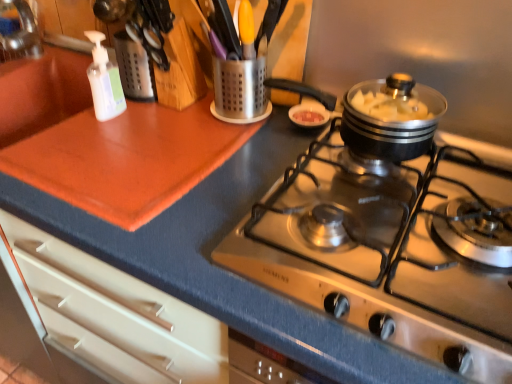
You are a GUI agent. You are given a task and a screenshot of the screen. Output one action in this format:
    pyautogui.click(x=<x>, y=<y>)
    Task: Click on the metallic utensil holder at upper center
    
    Given the screenshot: What is the action you would take?
    pyautogui.click(x=244, y=68)

I want to click on stainless steel cooktop at center, so click(386, 240).

Between white translucent bottle at upper left and metallic utensil holder at upper center, which one has more height?

white translucent bottle at upper left is taller.

The height and width of the screenshot is (384, 512). I want to click on appliance that appears below the white translucent bottle at upper left (from the image's perspective), so click(x=244, y=68).

Measure the distance from white translucent bottle at upper left to metallic utensil holder at upper center.

A distance of 10.73 inches exists between white translucent bottle at upper left and metallic utensil holder at upper center.

Could metallic utensil holder at upper center be considered to be inside white translucent bottle at upper left?

Definitely not — metallic utensil holder at upper center is not inside white translucent bottle at upper left.

Which point is more distant from viewer, (x=483, y=233) or (x=109, y=86)?

Point (x=109, y=86)

The width and height of the screenshot is (512, 384). I want to click on gas stove on the right of white translucent bottle at upper left, so click(x=386, y=240).

From the image's perspective, is stainless steel cooktop at center below white translucent bottle at upper left?

Yes, from the image's perspective, stainless steel cooktop at center is beneath white translucent bottle at upper left.

Is white translucent bottle at upper left at the back of metallic utensil holder at upper center?

No.

Which object is further away from the camera, metallic utensil holder at upper center or white translucent bottle at upper left?

metallic utensil holder at upper center is more distant.

Which of these two, metallic utensil holder at upper center or white translucent bottle at upper left, is thinner?

Thinner between the two is white translucent bottle at upper left.

The width and height of the screenshot is (512, 384). I want to click on appliance below the white translucent bottle at upper left (from a real-world perspective), so click(x=244, y=68).

Based on their sizes in the image, would you say stainless steel cooktop at center is bigger or smaller than metallic utensil holder at upper center?

→ Clearly, stainless steel cooktop at center is larger in size than metallic utensil holder at upper center.

Between point (489, 220) and point (257, 77), which one is positioned behind?

The point (257, 77) is behind.

Based on the photo, considering the sizes of objects stainless steel cooktop at center and metallic utensil holder at upper center in the image provided, who is thinner, stainless steel cooktop at center or metallic utensil holder at upper center?

With smaller width is metallic utensil holder at upper center.

Based on the photo, how much distance is there between white translucent bottle at upper left and stainless steel cooktop at center?

A distance of 24.00 inches exists between white translucent bottle at upper left and stainless steel cooktop at center.

Is white translucent bottle at upper left next to stainless steel cooktop at center and touching it?

No, white translucent bottle at upper left is not with stainless steel cooktop at center.

Is white translucent bottle at upper left behind stainless steel cooktop at center?

Yes, white translucent bottle at upper left is behind stainless steel cooktop at center.

Does white translucent bottle at upper left appear on the left side of stainless steel cooktop at center?

Indeed, white translucent bottle at upper left is positioned on the left side of stainless steel cooktop at center.

From the picture: Which is closer, (231,116) or (464,328)?

Positioned in front is point (464,328).

Is metallic utensil holder at upper center wider than stainless steel cooktop at center?

Incorrect, the width of metallic utensil holder at upper center does not surpass that of stainless steel cooktop at center.

Which of these two, metallic utensil holder at upper center or stainless steel cooktop at center, is smaller?

With smaller size is metallic utensil holder at upper center.

You are a GUI agent. You are given a task and a screenshot of the screen. Output one action in this format:
    pyautogui.click(x=<x>, y=<y>)
    Task: Click on the appliance on the right of white translucent bottle at upper left
    The width and height of the screenshot is (512, 384).
    Given the screenshot: What is the action you would take?
    pyautogui.click(x=244, y=68)

This screenshot has width=512, height=384. What are the coordinates of `bottle above the stainless steel cooktop at center (from a real-world perspective)` in the screenshot? It's located at (104, 81).

In the scene shown: Based on their spatial positions, is metallic utensil holder at upper center or stainless steel cooktop at center further from white translucent bottle at upper left?

The object further to white translucent bottle at upper left is stainless steel cooktop at center.

Considering their positions, is stainless steel cooktop at center positioned closer to white translucent bottle at upper left than metallic utensil holder at upper center?

Based on the image, metallic utensil holder at upper center appears to be nearer to white translucent bottle at upper left.

Considering their positions, is white translucent bottle at upper left positioned closer to stainless steel cooktop at center than metallic utensil holder at upper center?

Among the two, metallic utensil holder at upper center is located nearer to stainless steel cooktop at center.

Based on their spatial positions, is stainless steel cooktop at center or white translucent bottle at upper left closer to metallic utensil holder at upper center?

white translucent bottle at upper left.

When comparing their distances from stainless steel cooktop at center, does metallic utensil holder at upper center or white translucent bottle at upper left seem closer?

metallic utensil holder at upper center is positioned closer to the anchor stainless steel cooktop at center.

Looking at the image, which one is located further to metallic utensil holder at upper center, white translucent bottle at upper left or stainless steel cooktop at center?

The object further to metallic utensil holder at upper center is stainless steel cooktop at center.

Find the location of a particular element. This screenshot has height=384, width=512. appliance between white translucent bottle at upper left and stainless steel cooktop at center is located at coordinates (244, 68).